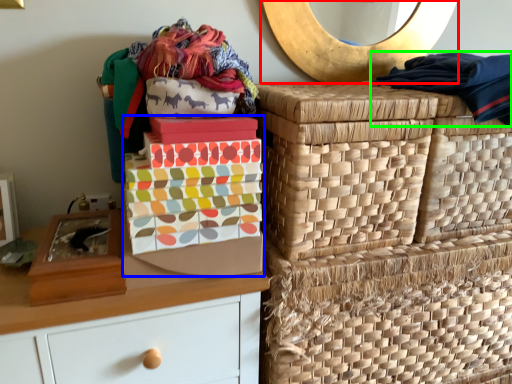
Question: Which object is the closest to the mirror (highlighted by a red box)? Choose among these: shoe box (highlighted by a blue box) or clothing (highlighted by a green box).

Choices:
 (A) shoe box
 (B) clothing

Answer: (B)